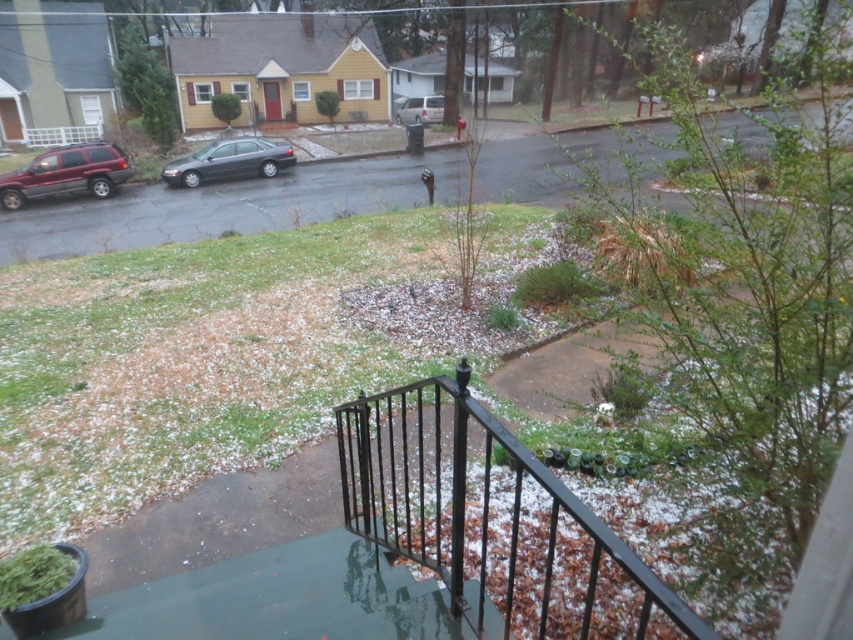
Question: Does black wrought iron railing at lower center have a lesser width compared to silver metallic van at center?

Choices:
 (A) no
 (B) yes

Answer: (A)

Question: Can you confirm if black wrought iron railing at lower center is positioned above shiny dark gray sedan at center-left?

Choices:
 (A) no
 (B) yes

Answer: (A)

Question: Estimate the real-world distances between objects in this image. Which object is farther from the shiny dark gray sedan at center-left?

Choices:
 (A) metallic maroon suv at left
 (B) silver metallic van at center
 (C) black wrought iron railing at lower center

Answer: (C)

Question: Which point appears farthest from the camera in this image?

Choices:
 (A) (67, 176)
 (B) (363, 472)
 (C) (421, 120)
 (D) (210, 179)

Answer: (C)

Question: Which point is closer to the camera?

Choices:
 (A) metallic maroon suv at left
 (B) silver metallic van at center
 (C) black wrought iron railing at lower center

Answer: (C)

Question: Does black wrought iron railing at lower center appear over silver metallic van at center?

Choices:
 (A) no
 (B) yes

Answer: (A)